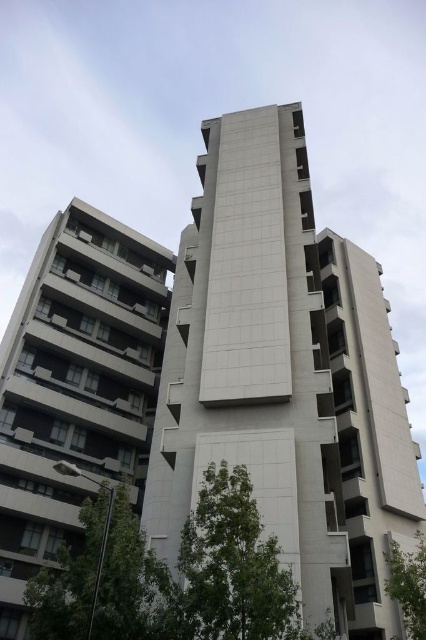
Question: Does white smooth building at left appear under green leafy tree at lower center?

Choices:
 (A) yes
 (B) no

Answer: (B)

Question: Estimate the real-world distances between objects in this image. Which object is farther from the green leafy tree at lower left?

Choices:
 (A) green leafy tree at lower right
 (B) white smooth building at left
 (C) white concrete building at center
 (D) green leafy tree at lower center

Answer: (B)

Question: Which point appears farthest from the camera in this image?

Choices:
 (A) (249, 524)
 (B) (382, 572)

Answer: (B)

Question: Can you confirm if green leafy tree at lower center is smaller than green leafy tree at lower right?

Choices:
 (A) yes
 (B) no

Answer: (A)

Question: Estimate the real-world distances between objects in this image. Which object is farther from the green leafy tree at lower right?

Choices:
 (A) white smooth building at left
 (B) white concrete building at center
 (C) green leafy tree at lower left

Answer: (A)

Question: Is white concrete building at center to the right of white smooth building at left from the viewer's perspective?

Choices:
 (A) yes
 (B) no

Answer: (A)